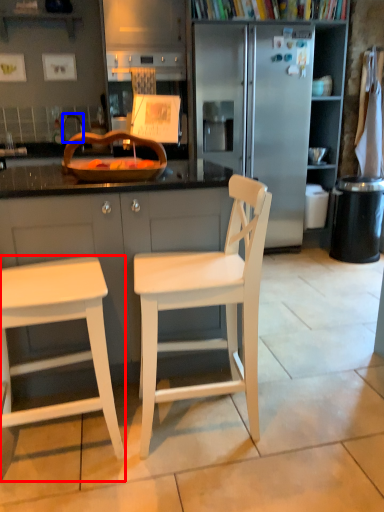
Question: Among these objects, which one is nearest to the camera, stool (highlighted by a red box) or faucet (highlighted by a blue box)?

Choices:
 (A) stool
 (B) faucet

Answer: (A)